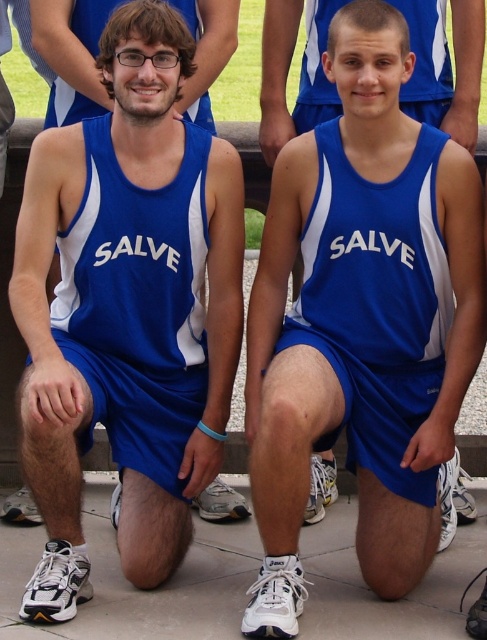
Question: Which point is farther to the camera?

Choices:
 (A) (151, 205)
 (B) (315, 90)
 (C) (92, 28)
 (D) (412, 168)

Answer: (B)

Question: Does matte blue singlet at center have a greater width compared to matte blue singlet at upper center?

Choices:
 (A) no
 (B) yes

Answer: (B)

Question: Among these objects, which one is nearest to the camera?

Choices:
 (A) blue fabric shorts at lower left
 (B) matte blue singlet at center
 (C) matte blue singlet at upper center

Answer: (B)

Question: Where is blue fabric shorts at lower left located in relation to matte blue singlet at center in the image?

Choices:
 (A) below
 (B) above

Answer: (B)

Question: Which point is closer to the camera?

Choices:
 (A) matte blue singlet at upper center
 (B) matte blue singlet at center
 (C) blue fabric shorts at center

Answer: (B)

Question: Does blue fabric shorts at lower left have a lesser width compared to matte blue singlet at center?

Choices:
 (A) yes
 (B) no

Answer: (A)